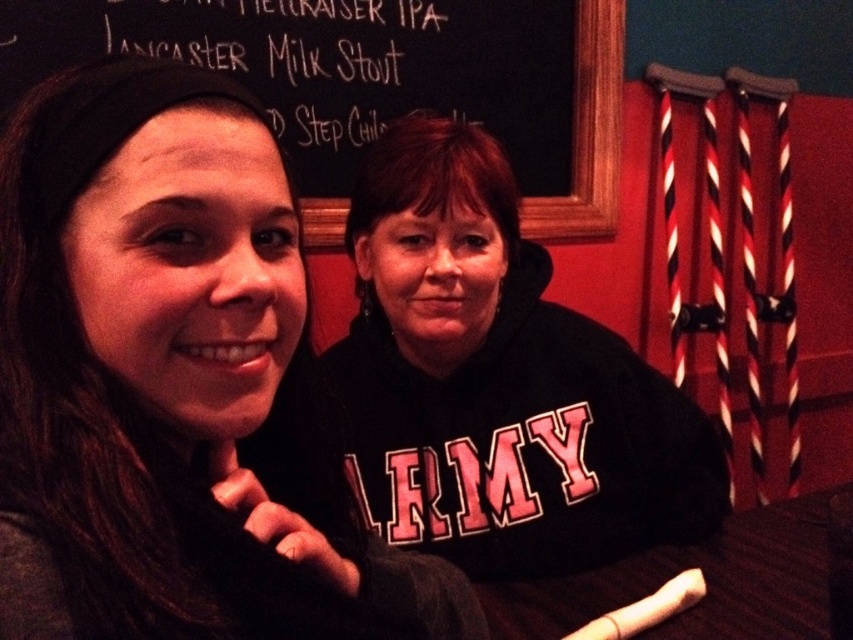
Question: Can you confirm if matte black hoodie at center is positioned above black chalkboard at upper center?

Choices:
 (A) no
 (B) yes

Answer: (A)

Question: Observing the image, what is the correct spatial positioning of matte black hoodie at center in reference to black chalkboard at upper center?

Choices:
 (A) above
 (B) below

Answer: (B)

Question: Which point is farther from the camera taking this photo?

Choices:
 (A) (65, 461)
 (B) (612, 122)

Answer: (B)

Question: Can you confirm if matte black hoodie at center is positioned to the right of black chalkboard at upper center?

Choices:
 (A) no
 (B) yes

Answer: (A)